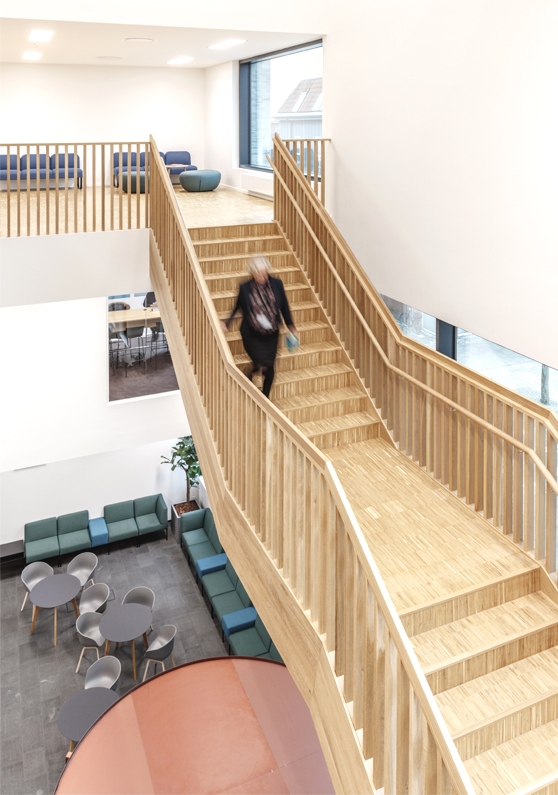
Identify the location of green couches. (257, 640), (226, 602), (199, 545), (134, 524), (56, 534).